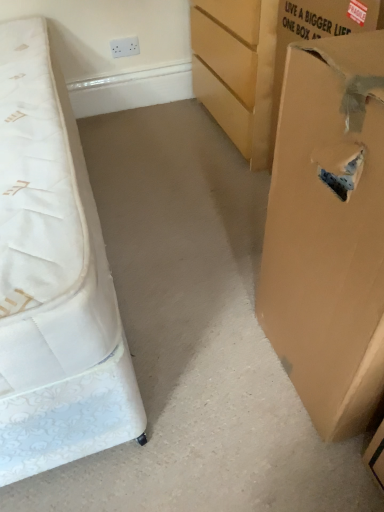
Question: From the image's perspective, is white quilted mattress at left on brown cardboard box at right, arranged as the second cardboard box when viewed from the front?

Choices:
 (A) no
 (B) yes

Answer: (A)

Question: From a real-world perspective, does white quilted mattress at left stand above brown cardboard box at right, the 1th cardboard box positioned from the back?

Choices:
 (A) no
 (B) yes

Answer: (A)

Question: Is white quilted mattress at left aimed at brown cardboard box at right, positioned as the 1th cardboard box in top-to-bottom order?

Choices:
 (A) no
 (B) yes

Answer: (A)

Question: Does white quilted mattress at left have a smaller size compared to brown cardboard box at right, which ranks as the second cardboard box in bottom-to-top order?

Choices:
 (A) yes
 (B) no

Answer: (B)

Question: Considering the relative sizes of white quilted mattress at left and brown cardboard box at right, arranged as the second cardboard box when viewed from the front, in the image provided, is white quilted mattress at left bigger than brown cardboard box at right, arranged as the second cardboard box when viewed from the front,?

Choices:
 (A) yes
 (B) no

Answer: (A)

Question: In the image, is white quilted mattress at left positioned in front of or behind brown cardboard box at right, arranged as the second cardboard box when viewed from the front?

Choices:
 (A) front
 (B) behind

Answer: (A)

Question: From a real-world perspective, is white quilted mattress at left physically located above or below brown cardboard box at right, which ranks as the second cardboard box in bottom-to-top order?

Choices:
 (A) below
 (B) above

Answer: (A)

Question: Is white quilted mattress at left bigger or smaller than brown cardboard box at right, the 1th cardboard box positioned from the back?

Choices:
 (A) big
 (B) small

Answer: (A)

Question: Is point (46, 102) positioned closer to the camera than point (254, 105)?

Choices:
 (A) closer
 (B) farther

Answer: (A)

Question: Considering the positions of white quilted mattress at left and brown cardboard box at right, the 2th cardboard box in the back-to-front sequence, in the image, is white quilted mattress at left taller or shorter than brown cardboard box at right, the 2th cardboard box in the back-to-front sequence,?

Choices:
 (A) tall
 (B) short

Answer: (B)

Question: Considering their positions, is white quilted mattress at left located in front of or behind brown cardboard box at right, marked as the first cardboard box in a bottom-to-top arrangement?

Choices:
 (A) front
 (B) behind

Answer: (B)

Question: From the image's perspective, is white quilted mattress at left above or below brown cardboard box at right, the 2th cardboard box in the back-to-front sequence?

Choices:
 (A) below
 (B) above

Answer: (B)

Question: From a real-world perspective, is white quilted mattress at left positioned above or below brown cardboard box at right, the 2th cardboard box in the back-to-front sequence?

Choices:
 (A) above
 (B) below

Answer: (B)

Question: Looking at their shapes, would you say brown cardboard box at right, acting as the 2th cardboard box starting from the top, is wider or thinner than white quilted mattress at left?

Choices:
 (A) wide
 (B) thin

Answer: (B)

Question: From the image's perspective, is brown cardboard box at right, the 2th cardboard box in the back-to-front sequence, above or below white quilted mattress at left?

Choices:
 (A) above
 (B) below

Answer: (B)